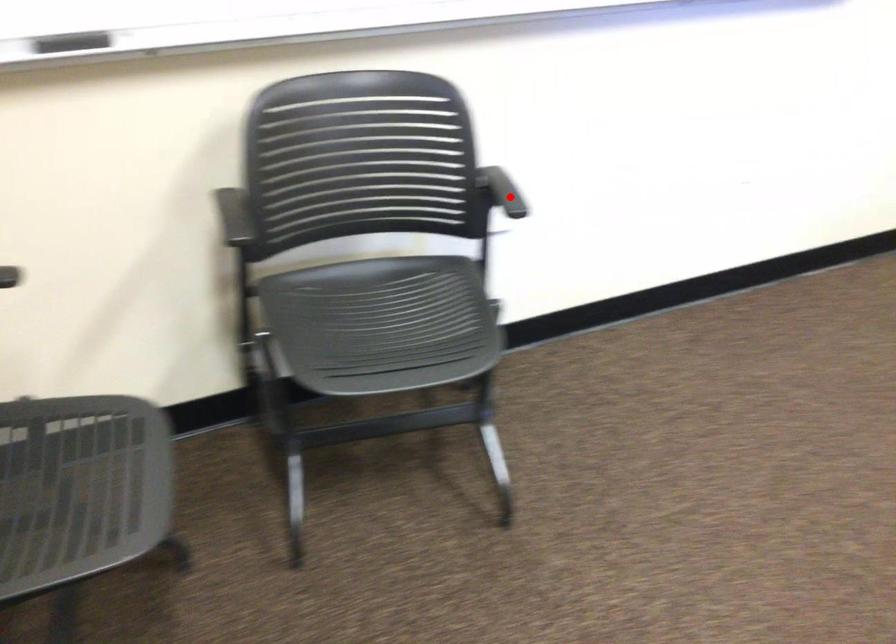
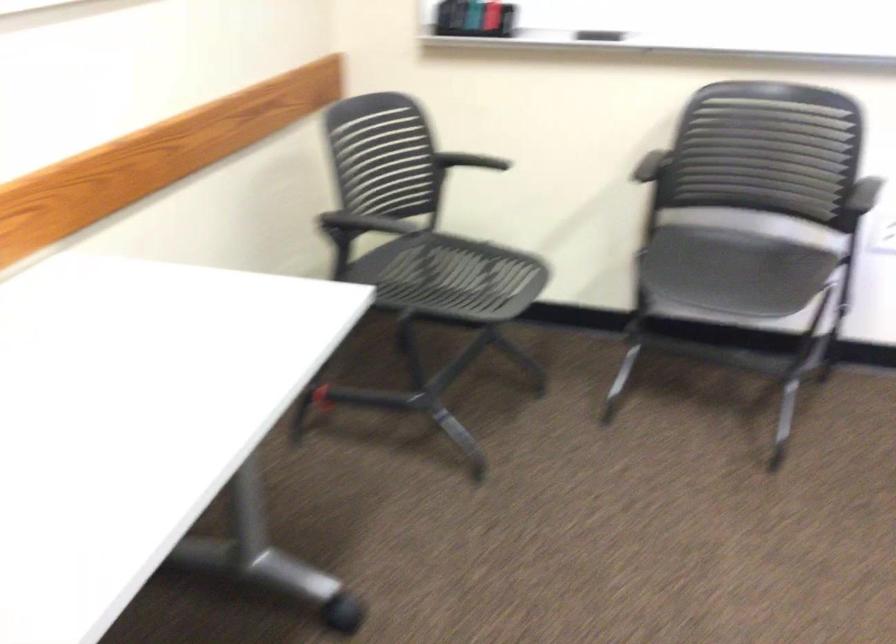
Find the pixel in the second image that matches the highlighted location in the first image.

(865, 194)